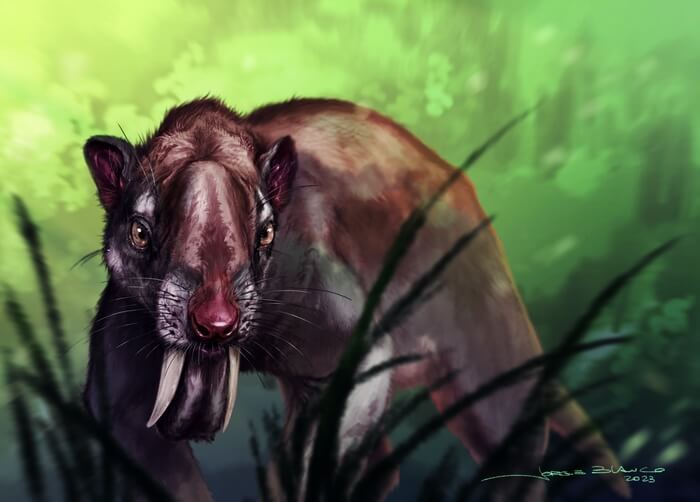
Where is `painting`? Image resolution: width=700 pixels, height=502 pixels. painting is located at coordinates (614, 141).